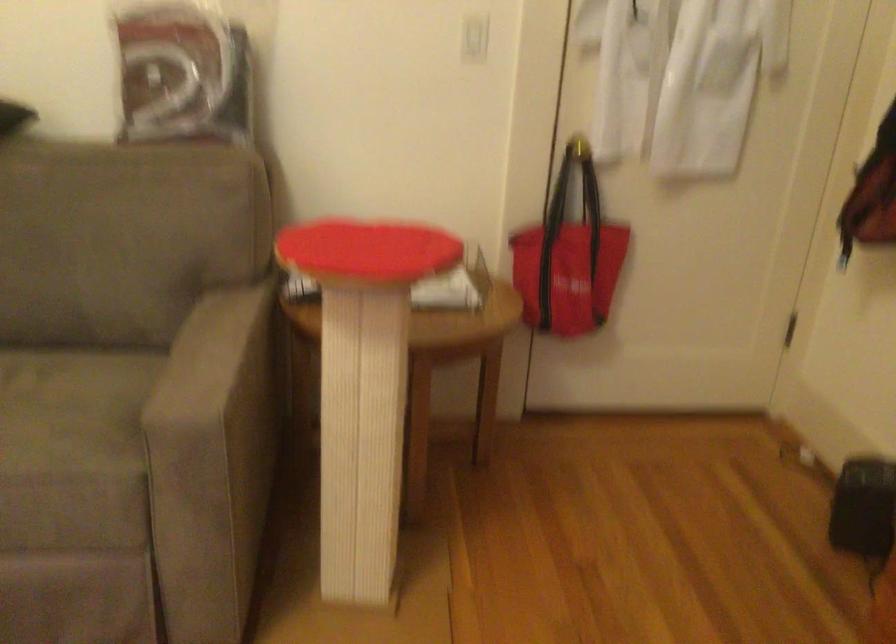
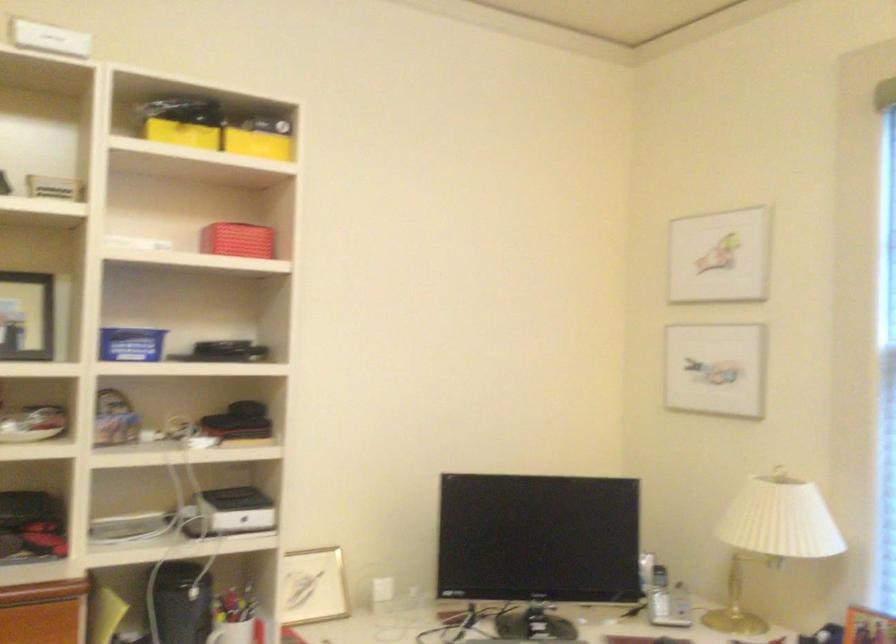
Question: The camera is either moving clockwise (left) or counter-clockwise (right) around the object. The first image is from the beginning of the video and the second image is from the end. Is the camera moving left or right when shooting the video?

Choices:
 (A) Left
 (B) Right

Answer: (A)